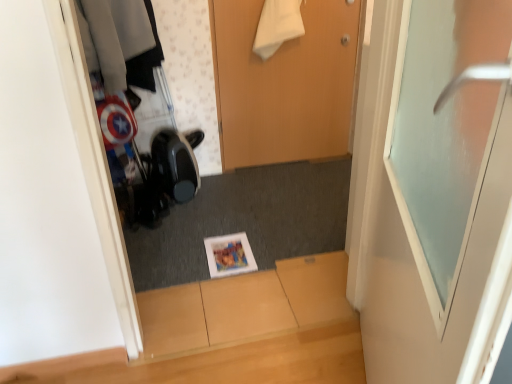
Find the location of a particular element. unoccupied space behind matte paper magazine at center is located at coordinates (232, 223).